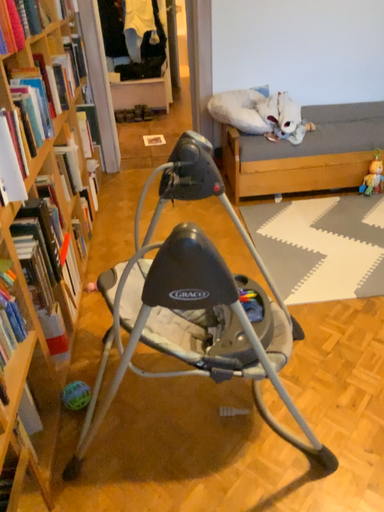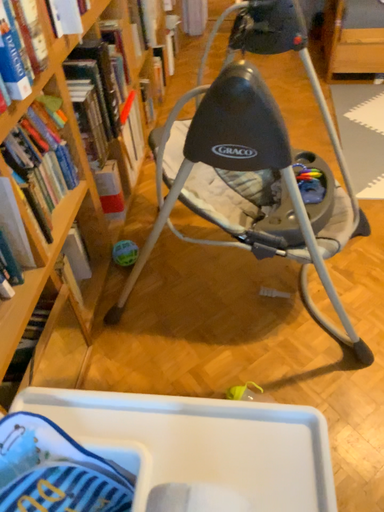
Question: How did the camera likely rotate when shooting the video?

Choices:
 (A) rotated right
 (B) rotated left

Answer: (B)